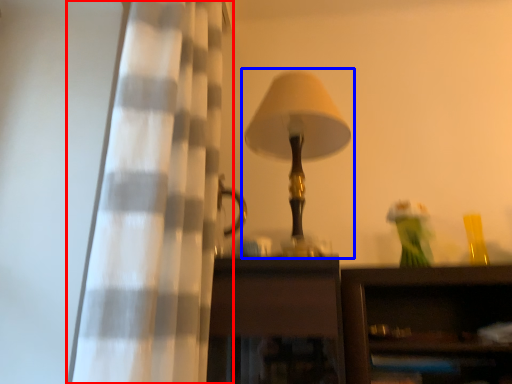
Question: Among these objects, which one is farthest to the camera, curtain (highlighted by a red box) or lamp (highlighted by a blue box)?

Choices:
 (A) curtain
 (B) lamp

Answer: (B)